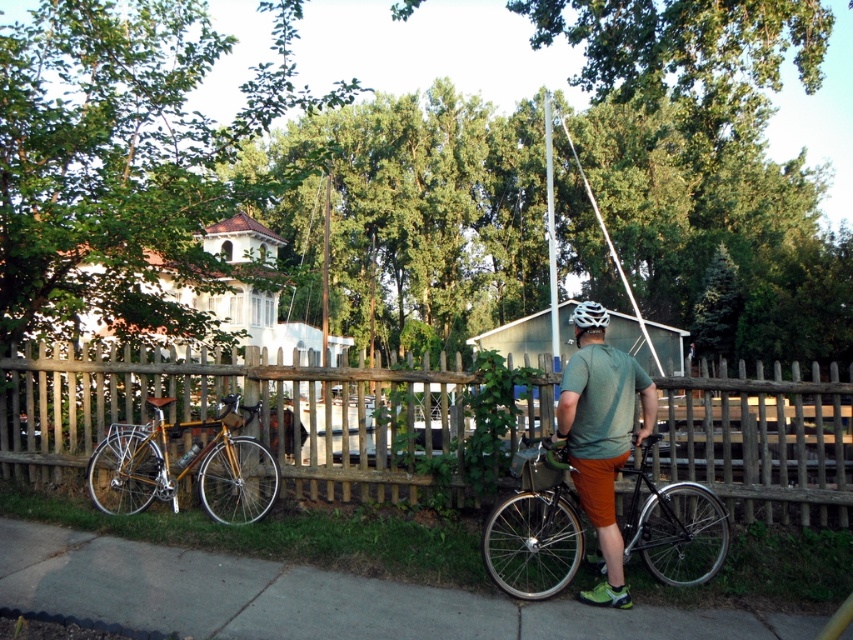
Who is shorter, shiny silver bicycle at center or gold bamboo bicycle at lower left?

With less height is gold bamboo bicycle at lower left.

Is shiny silver bicycle at center positioned behind gold bamboo bicycle at lower left?

No, it is not.

Describe the element at coordinates (534, 532) in the screenshot. The height and width of the screenshot is (640, 853). I see `shiny silver bicycle at center` at that location.

Identify the location of shiny silver bicycle at center. This screenshot has width=853, height=640. (534, 532).

Between green matte shirt at center and gold bamboo bicycle at lower left, which one appears on the right side from the viewer's perspective?

green matte shirt at center is more to the right.

Between point (595, 484) and point (241, 417), which one is positioned behind?

The point (241, 417) is more distant.

Find the location of a particular element. Image resolution: width=853 pixels, height=640 pixels. green matte shirt at center is located at coordinates (601, 442).

Between green matte shirt at center and white glossy bicycle helmet at upper center, which one has more height?

white glossy bicycle helmet at upper center

Locate an element on the screen. The image size is (853, 640). green matte shirt at center is located at coordinates (601, 442).

Find the location of a particular element. This screenshot has width=853, height=640. green matte shirt at center is located at coordinates (601, 442).